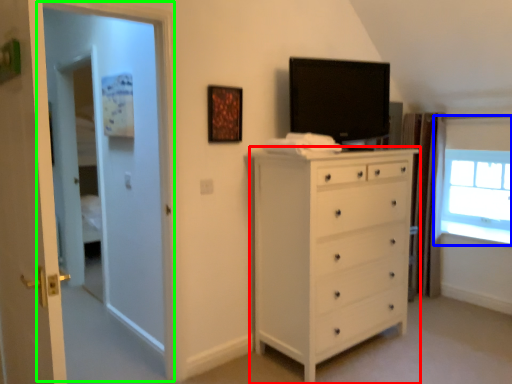
Question: Which object is the farthest from chest of drawers (highlighted by a red box)? Choose among these: window (highlighted by a blue box) or screen door (highlighted by a green box).

Choices:
 (A) window
 (B) screen door

Answer: (A)